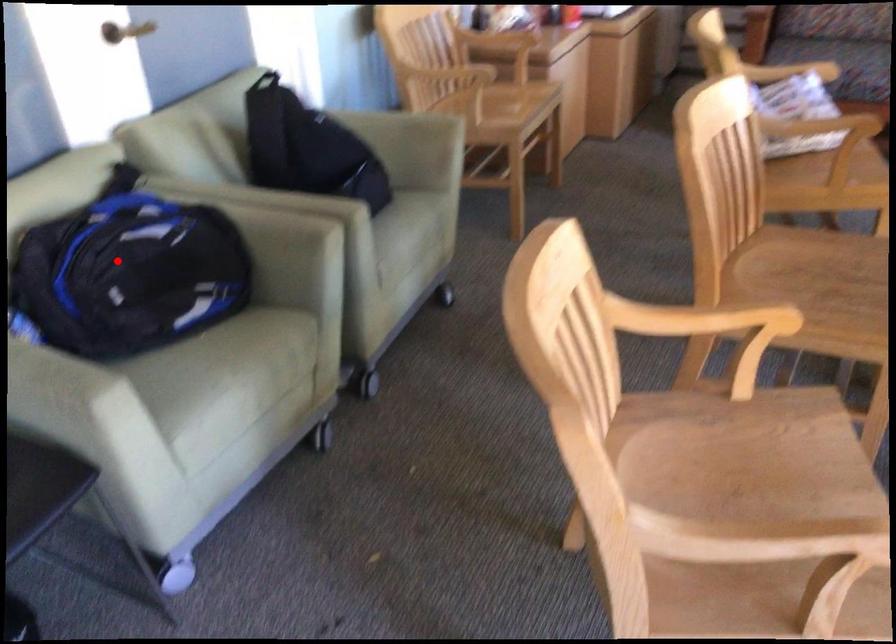
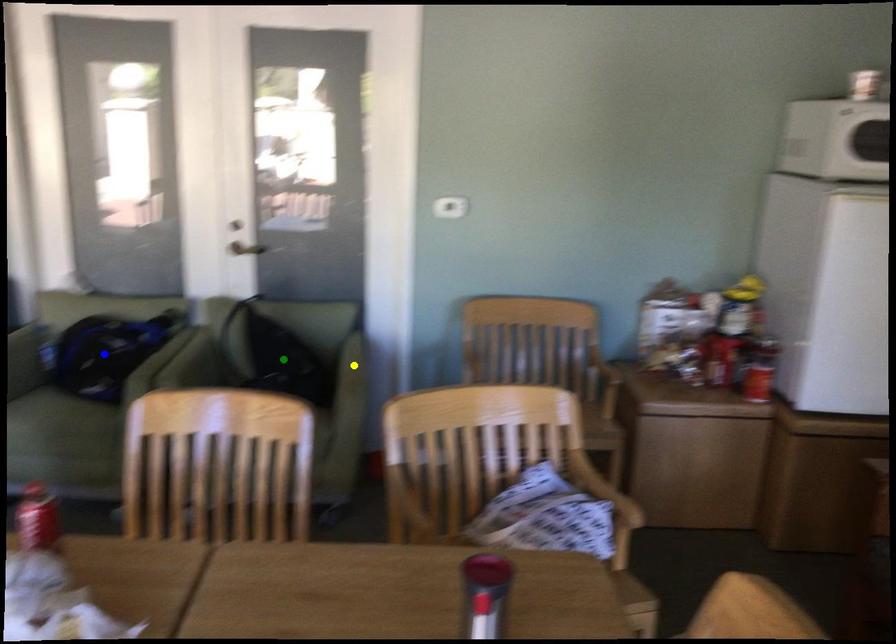
Question: I am providing you with two images of the same scene from different viewpoints. A red point is marked on the first image. You are given multiple points on the second image. Which point in image 2 represents the same 3d spot as the red point in image 1?

Choices:
 (A) blue point
 (B) green point
 (C) yellow point

Answer: (A)